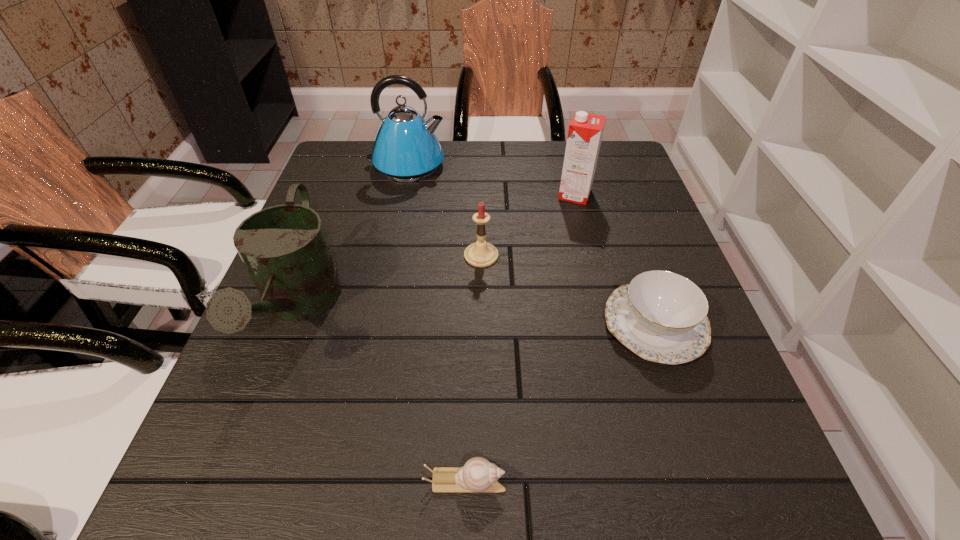
Identify the location of kettle. tap(406, 149).

Locate an element on the screen. The width and height of the screenshot is (960, 540). carton is located at coordinates (585, 132).

Where is `watering can`? watering can is located at coordinates (284, 248).

This screenshot has width=960, height=540. What are the coordinates of `candle` in the screenshot? It's located at (480, 254).

Identify the location of the second shortest object. (661, 316).

Locate an element on the screen. escargot is located at coordinates (478, 475).

The image size is (960, 540). What are the coordinates of `the shortest object` in the screenshot? It's located at (478, 475).

The width and height of the screenshot is (960, 540). I want to click on free space located 0.270m at the spout of the kettle, so click(x=544, y=165).

Locate an element on the screen. The image size is (960, 540). free space located 0.140m on the front of the carton is located at coordinates (588, 243).

Locate an element on the screen. vacant area situated 0.080m with the spout on the watering can is located at coordinates (250, 441).